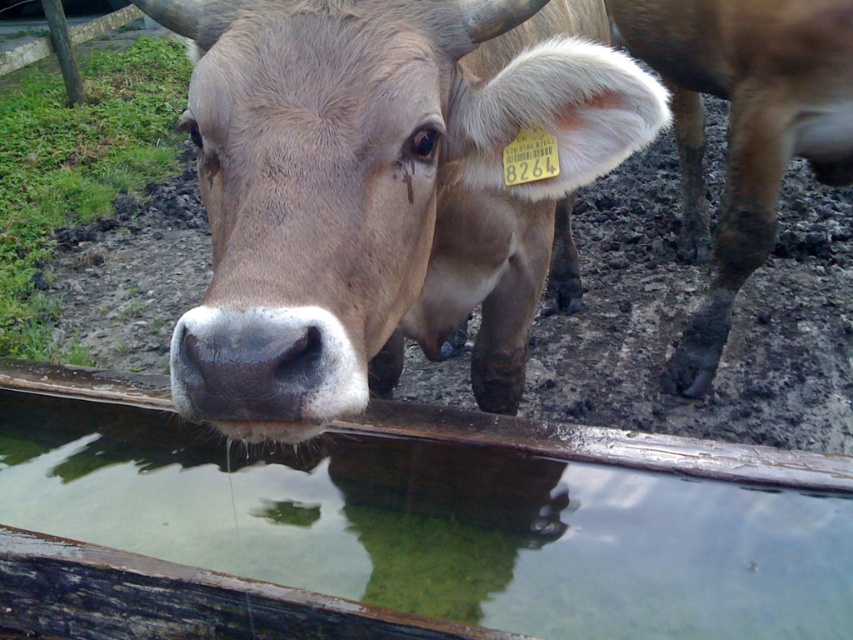
You are a farmer observing the brown matte cow at center and the brown muddy leg at lower right in the image. Which object appears taller in the picture?

The brown muddy leg at lower right appears taller than the brown matte cow at center in the image.

You are standing in a farm area and want to take a photo of the cow drinking from the trough. You notice two points marked on the ground at coordinates point (755, 580) and point (799, 1). Which point is closer to you if you are facing the cow?

Point (755, 580) is closer to the camera than point (799, 1), so if you are facing the cow, point (755, 580) is closer to you.